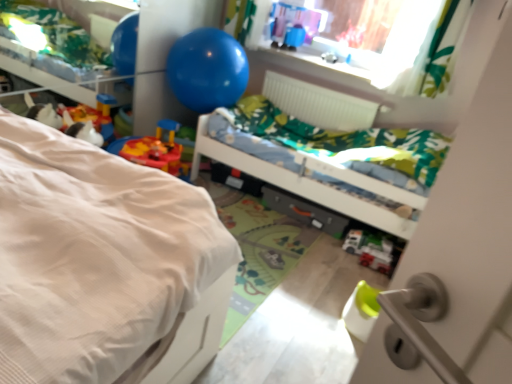
Question: Does white plastic toy car at lower center, marked as the 1th toy in a right-to-left arrangement, have a greater height compared to blue rubber balloon at upper center?

Choices:
 (A) yes
 (B) no

Answer: (B)

Question: Does white plastic toy car at lower center, the 2th toy viewed from the back, come behind blue rubber balloon at upper center?

Choices:
 (A) yes
 (B) no

Answer: (B)

Question: Considering the relative sizes of white plastic toy car at lower center, placed as the 1th toy when sorted from bottom to top, and blue rubber balloon at upper center in the image provided, is white plastic toy car at lower center, placed as the 1th toy when sorted from bottom to top, shorter than blue rubber balloon at upper center?

Choices:
 (A) no
 (B) yes

Answer: (B)

Question: Is white plastic toy car at lower center, the first toy in the front-to-back sequence, bigger than blue rubber balloon at upper center?

Choices:
 (A) no
 (B) yes

Answer: (A)

Question: Is white plastic toy car at lower center, marked as the 1th toy in a right-to-left arrangement, touching blue rubber balloon at upper center?

Choices:
 (A) yes
 (B) no

Answer: (B)

Question: In terms of width, does metallic gray drawer at center look wider or thinner when compared to blue rubber balloon at upper center?

Choices:
 (A) wide
 (B) thin

Answer: (B)

Question: Considering the positions of point (270, 205) and point (190, 87), is point (270, 205) closer or farther from the camera than point (190, 87)?

Choices:
 (A) farther
 (B) closer

Answer: (A)

Question: In the image, is metallic gray drawer at center positioned in front of or behind blue rubber balloon at upper center?

Choices:
 (A) behind
 (B) front

Answer: (A)

Question: Based on their sizes in the image, would you say metallic gray drawer at center is bigger or smaller than blue rubber balloon at upper center?

Choices:
 (A) small
 (B) big

Answer: (A)

Question: Would you say white textured bed at left, the second bed viewed from the back, is to the left or to the right of green fabric bed at center, which is the 2th bed in front-to-back order, in the picture?

Choices:
 (A) left
 (B) right

Answer: (A)

Question: In terms of height, does white textured bed at left, positioned as the first bed in front-to-back order, look taller or shorter compared to green fabric bed at center, which is the 2th bed in front-to-back order?

Choices:
 (A) short
 (B) tall

Answer: (B)

Question: In the image, is white textured bed at left, the second bed viewed from the back, positioned in front of or behind green fabric bed at center, which is the 2th bed in front-to-back order?

Choices:
 (A) front
 (B) behind

Answer: (A)

Question: From the image's perspective, is white textured bed at left, the second bed viewed from the back, above or below green fabric bed at center, which is the 2th bed in front-to-back order?

Choices:
 (A) above
 (B) below

Answer: (B)

Question: Is metallic gray drawer at center taller or shorter than white plastic toy car at lower center, placed as the 1th toy when sorted from bottom to top?

Choices:
 (A) short
 (B) tall

Answer: (B)

Question: Based on their sizes in the image, would you say metallic gray drawer at center is bigger or smaller than white plastic toy car at lower center, placed as the second toy when sorted from top to bottom?

Choices:
 (A) small
 (B) big

Answer: (B)